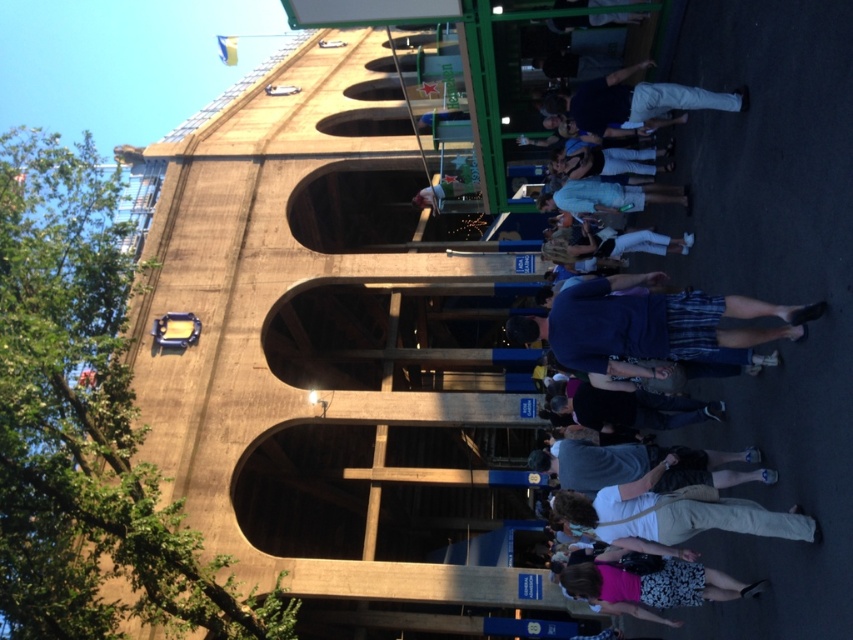
Question: Which of the following is the closest to the observer?

Choices:
 (A) (686, 42)
 (B) (682, 580)

Answer: (B)

Question: Among these objects, which one is farthest from the camera?

Choices:
 (A) light blue denim shorts at center
 (B) floral skirt at lower right
 (C) white cotton pants at center

Answer: (A)

Question: Which of the following is the closest to the observer?

Choices:
 (A) (583, 596)
 (B) (635, 195)

Answer: (A)

Question: Is floral skirt at lower right to the left of light blue denim shorts at center from the viewer's perspective?

Choices:
 (A) yes
 (B) no

Answer: (B)

Question: From the image, what is the correct spatial relationship of floral skirt at lower right in relation to light blue denim shorts at center?

Choices:
 (A) left
 (B) right

Answer: (B)

Question: Considering the relative positions of floral skirt at lower right and light blue denim shorts at center in the image provided, where is floral skirt at lower right located with respect to light blue denim shorts at center?

Choices:
 (A) below
 (B) above

Answer: (A)